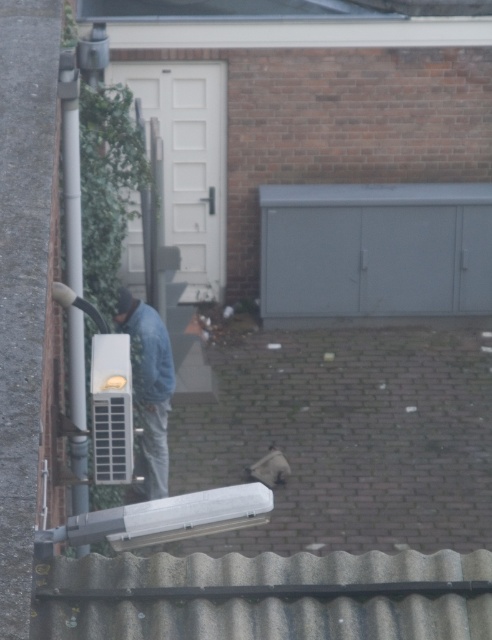
You are a delivery person trying to locate the correct entrance to deliver a package. You see a gray matte cabinet at upper center and a smooth gray roof at upper center. Which object is closer to you?

The gray matte cabinet at upper center is closer to you because the smooth gray roof at upper center is behind it.

In the scene shown: You are a delivery person trying to locate the gray matte cabinet at upper center. According to the scene description, where should you look relative to the white door with a small window panel?

The gray matte cabinet at upper center is located at point coordinates (375, 250), which places it above and to the left of the white door with a small window panel.